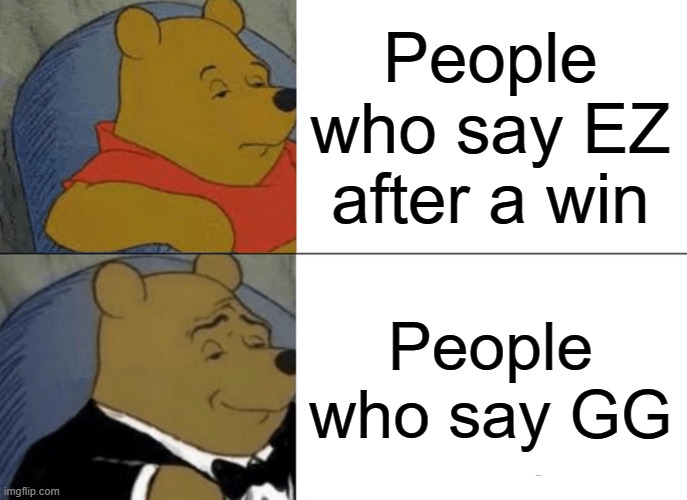
This screenshot has width=687, height=500. I want to click on blue chair, so click(55, 143), click(58, 360).